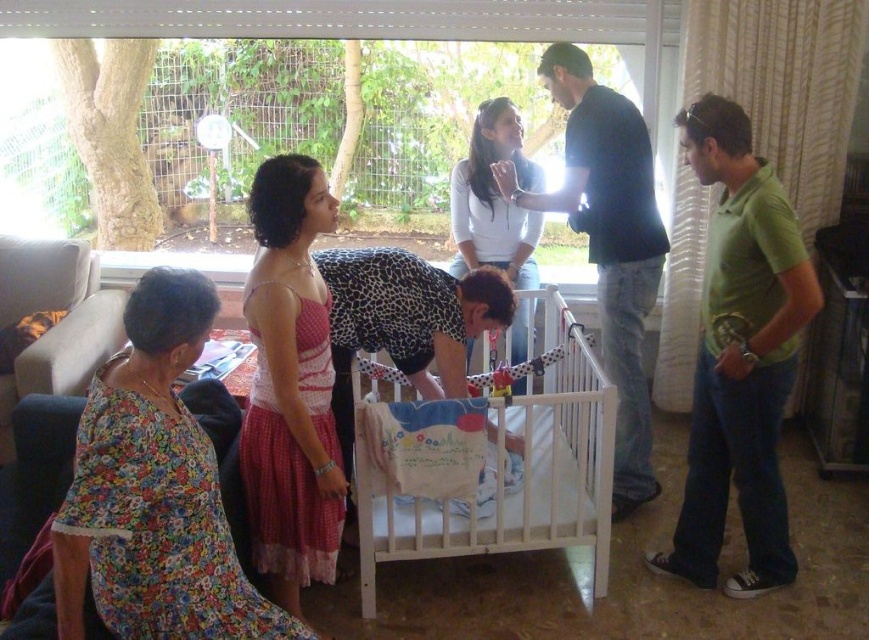
Is floral print dress at lower left smaller than white matte shirt at upper center?

Indeed, floral print dress at lower left has a smaller size compared to white matte shirt at upper center.

Which is more to the left, floral print dress at lower left or white matte shirt at upper center?

From the viewer's perspective, floral print dress at lower left appears more on the left side.

Between point (194, 317) and point (486, 150), which one is positioned in front?

Point (194, 317) is more forward.

The height and width of the screenshot is (640, 869). Identify the location of floral print dress at lower left. (154, 492).

Is floral print dress at lower left closer to camera compared to pink polka dot dress at center?

Yes, it is in front of pink polka dot dress at center.

Is point (260, 598) behind point (330, 464)?

That is False.

Find the location of a particular element. This screenshot has width=869, height=640. floral print dress at lower left is located at coordinates (154, 492).

Is floral print dress at lower left in front of dark blue shirt at center?

Yes, it is.

Can you confirm if floral print dress at lower left is shorter than dark blue shirt at center?

Indeed, floral print dress at lower left has a lesser height compared to dark blue shirt at center.

Between point (83, 634) and point (600, 195), which one is positioned behind?

Positioned behind is point (600, 195).

The image size is (869, 640). I want to click on floral print dress at lower left, so click(154, 492).